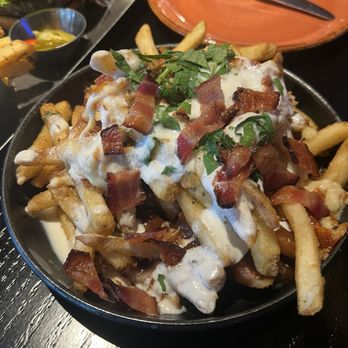
Locate an element on the screen. Image resolution: width=348 pixels, height=348 pixels. metal small container is located at coordinates (x=72, y=18).